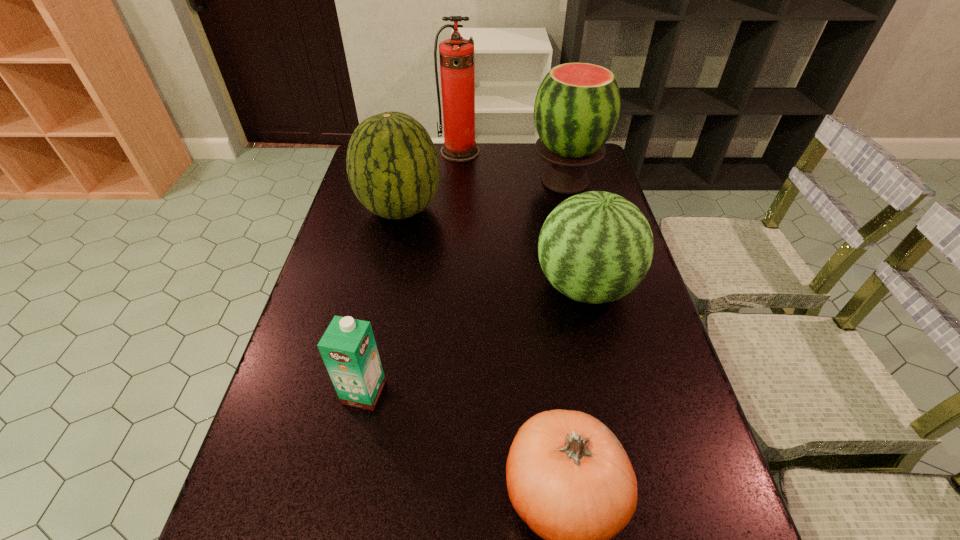
In order to click on the second closest watermelon to the fire extinguisher in this screenshot , I will do pos(577,106).

Identify the location of watermelon object that ranks as the third closest to the pumpkin. The height and width of the screenshot is (540, 960). (577, 106).